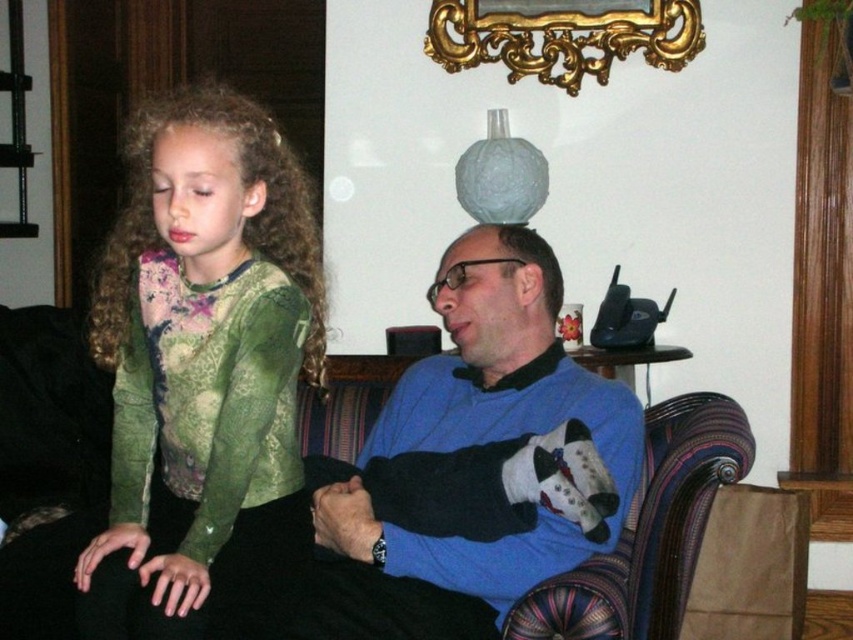
Between point (247, 544) and point (374, 609), which one is positioned behind?

Positioned behind is point (374, 609).

Between point (172, 214) and point (381, 534), which one is positioned in front?

Point (172, 214) is more forward.

Locate an element on the screen. This screenshot has width=853, height=640. green lace shirt at left is located at coordinates (202, 365).

Is blue soft sweater at center to the left of gold ornate mirror at upper center from the viewer's perspective?

Yes, blue soft sweater at center is to the left of gold ornate mirror at upper center.

Locate an element on the screen. The width and height of the screenshot is (853, 640). blue soft sweater at center is located at coordinates (467, 444).

Which of these two, green lace shirt at left or gold ornate mirror at upper center, stands shorter?

gold ornate mirror at upper center is shorter.

Does green lace shirt at left appear under gold ornate mirror at upper center?

Yes.

The height and width of the screenshot is (640, 853). Describe the element at coordinates (202, 365) in the screenshot. I see `green lace shirt at left` at that location.

Where is `green lace shirt at left`? green lace shirt at left is located at coordinates (202, 365).